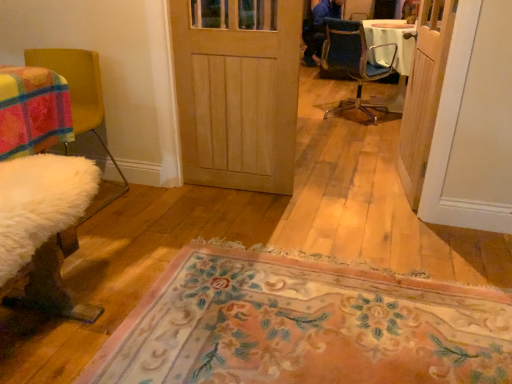
Question: Is natural wood door at center, positioned as the first door in left-to-right order, next to floral carpet at center?

Choices:
 (A) yes
 (B) no

Answer: (B)

Question: Is the depth of natural wood door at center, positioned as the first door in left-to-right order, greater than that of floral carpet at center?

Choices:
 (A) yes
 (B) no

Answer: (A)

Question: Does natural wood door at center, which appears as the second door when viewed from the right, appear on the right side of floral carpet at center?

Choices:
 (A) yes
 (B) no

Answer: (B)

Question: Is natural wood door at center, positioned as the first door in left-to-right order, shorter than floral carpet at center?

Choices:
 (A) yes
 (B) no

Answer: (B)

Question: Is the position of natural wood door at center, positioned as the first door in left-to-right order, less distant than that of floral carpet at center?

Choices:
 (A) yes
 (B) no

Answer: (B)

Question: In terms of height, does white fluffy chair at left, the first chair when ordered from front to back, look taller or shorter compared to blue fabric chair at center, the 1th chair from the top?

Choices:
 (A) tall
 (B) short

Answer: (B)

Question: Is white fluffy chair at left, which appears as the first chair when ordered from the bottom, in front of or behind blue fabric chair at center, the 1th chair positioned from the back, in the image?

Choices:
 (A) front
 (B) behind

Answer: (A)

Question: From a real-world perspective, is white fluffy chair at left, the first chair viewed from the left, above or below blue fabric chair at center, which appears as the second chair when ordered from the bottom?

Choices:
 (A) above
 (B) below

Answer: (B)

Question: In terms of width, does white fluffy chair at left, which is the second chair from top to bottom, look wider or thinner when compared to blue fabric chair at center, the 1th chair positioned from the back?

Choices:
 (A) wide
 (B) thin

Answer: (A)

Question: Relative to wooden door at right, which appears as the 2th door when viewed from the left, is floral carpet at center in front or behind?

Choices:
 (A) behind
 (B) front

Answer: (B)

Question: Is floral carpet at center situated inside wooden door at right, placed as the 1th door when sorted from right to left, or outside?

Choices:
 (A) outside
 (B) inside

Answer: (A)

Question: From the image's perspective, is floral carpet at center positioned above or below wooden door at right, placed as the 1th door when sorted from right to left?

Choices:
 (A) below
 (B) above

Answer: (A)

Question: Based on their positions, is floral carpet at center located to the left or right of wooden door at right, which appears as the 2th door when viewed from the left?

Choices:
 (A) right
 (B) left

Answer: (B)

Question: From the image's perspective, is white fluffy chair at left, which is counted as the second chair, starting from the right, positioned above or below natural wood door at center, which appears as the second door when viewed from the right?

Choices:
 (A) below
 (B) above

Answer: (A)

Question: Looking at the image, does white fluffy chair at left, which is counted as the second chair, starting from the right, seem bigger or smaller compared to natural wood door at center, positioned as the first door in left-to-right order?

Choices:
 (A) small
 (B) big

Answer: (B)